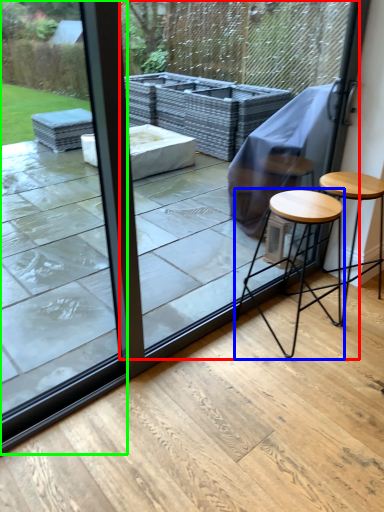
Question: Estimate the real-world distances between objects in this image. Which object is closer to screen door (highlighted by a red box), stool (highlighted by a blue box) or glass door (highlighted by a green box)?

Choices:
 (A) stool
 (B) glass door

Answer: (A)